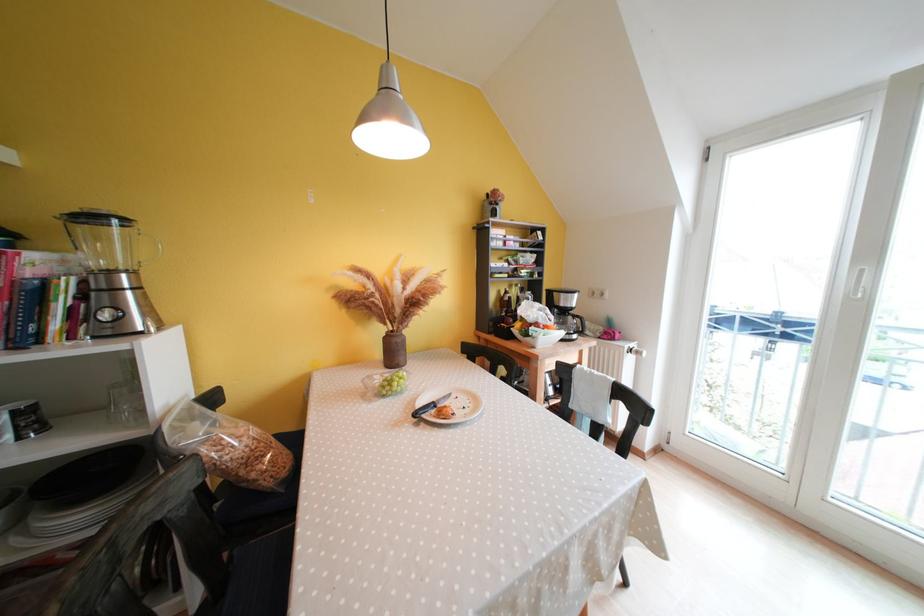
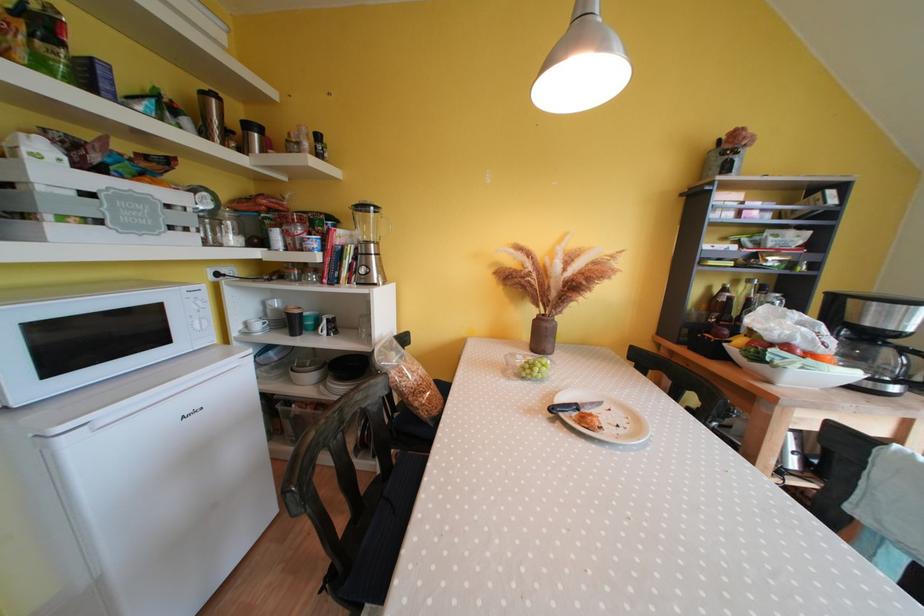
The point at (513, 296) is marked in the first image. Where is the corresponding point in the second image?

(731, 294)